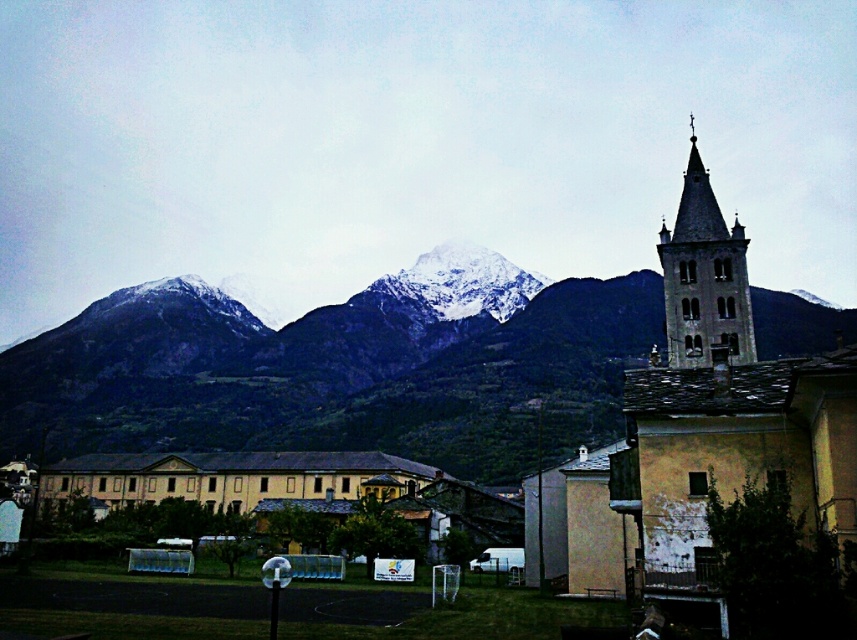
Question: Where is yellow stone church at right located in relation to dark gray stone bell tower at upper right in the image?

Choices:
 (A) right
 (B) left

Answer: (A)

Question: Based on their relative distances, which object is farther from the yellow stone church at right?

Choices:
 (A) dark gray stone bell tower at upper right
 (B) snowy rock mountain range at upper center

Answer: (B)

Question: Observing the image, what is the correct spatial positioning of yellow stone church at right in reference to dark gray stone bell tower at upper right?

Choices:
 (A) above
 (B) below

Answer: (B)

Question: Which of the following is the farthest from the observer?

Choices:
 (A) (790, 388)
 (B) (376, 440)
 (C) (674, 260)

Answer: (B)

Question: Which point appears closest to the camera in this image?

Choices:
 (A) (156, 380)
 (B) (636, 452)

Answer: (B)

Question: Does yellow stone church at right have a smaller size compared to dark gray stone bell tower at upper right?

Choices:
 (A) yes
 (B) no

Answer: (B)